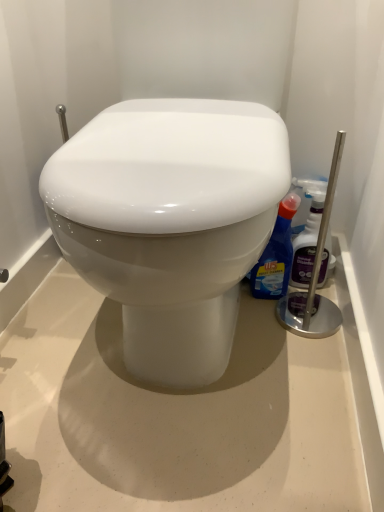
Question: Does translucent plastic spray bottle at right, which is the second cleaning product from left to right, have a smaller size compared to blue glossy toilet cleaner at right, marked as the 2th cleaning product in a right-to-left arrangement?

Choices:
 (A) no
 (B) yes

Answer: (B)

Question: Can you confirm if translucent plastic spray bottle at right, which is the second cleaning product from left to right, is taller than blue glossy toilet cleaner at right, which is the first cleaning product in left-to-right order?

Choices:
 (A) yes
 (B) no

Answer: (A)

Question: Is there a large distance between translucent plastic spray bottle at right, which is the second cleaning product from left to right, and blue glossy toilet cleaner at right, which is the first cleaning product in left-to-right order?

Choices:
 (A) yes
 (B) no

Answer: (B)

Question: Is translucent plastic spray bottle at right, arranged as the 1th cleaning product when viewed from the right, thinner than blue glossy toilet cleaner at right, which is the first cleaning product in left-to-right order?

Choices:
 (A) no
 (B) yes

Answer: (B)

Question: Does translucent plastic spray bottle at right, arranged as the 1th cleaning product when viewed from the right, have a greater width compared to blue glossy toilet cleaner at right, marked as the 2th cleaning product in a right-to-left arrangement?

Choices:
 (A) no
 (B) yes

Answer: (A)

Question: Is translucent plastic spray bottle at right, arranged as the 1th cleaning product when viewed from the right, at the right side of blue glossy toilet cleaner at right, which is the first cleaning product in left-to-right order?

Choices:
 (A) yes
 (B) no

Answer: (A)

Question: Is blue glossy toilet cleaner at right, which is the first cleaning product in left-to-right order, wider than translucent plastic spray bottle at right, which is the second cleaning product from left to right?

Choices:
 (A) no
 (B) yes

Answer: (B)

Question: Can you confirm if blue glossy toilet cleaner at right, marked as the 2th cleaning product in a right-to-left arrangement, is positioned to the left of translucent plastic spray bottle at right, arranged as the 1th cleaning product when viewed from the right?

Choices:
 (A) no
 (B) yes

Answer: (B)

Question: Considering the relative sizes of blue glossy toilet cleaner at right, marked as the 2th cleaning product in a right-to-left arrangement, and translucent plastic spray bottle at right, arranged as the 1th cleaning product when viewed from the right, in the image provided, is blue glossy toilet cleaner at right, marked as the 2th cleaning product in a right-to-left arrangement, thinner than translucent plastic spray bottle at right, arranged as the 1th cleaning product when viewed from the right,?

Choices:
 (A) no
 (B) yes

Answer: (A)

Question: From a real-world perspective, is blue glossy toilet cleaner at right, which is the first cleaning product in left-to-right order, over translucent plastic spray bottle at right, which is the second cleaning product from left to right?

Choices:
 (A) yes
 (B) no

Answer: (B)

Question: Considering the relative sizes of blue glossy toilet cleaner at right, marked as the 2th cleaning product in a right-to-left arrangement, and translucent plastic spray bottle at right, arranged as the 1th cleaning product when viewed from the right, in the image provided, is blue glossy toilet cleaner at right, marked as the 2th cleaning product in a right-to-left arrangement, shorter than translucent plastic spray bottle at right, arranged as the 1th cleaning product when viewed from the right,?

Choices:
 (A) no
 (B) yes

Answer: (B)

Question: Does blue glossy toilet cleaner at right, marked as the 2th cleaning product in a right-to-left arrangement, have a greater height compared to translucent plastic spray bottle at right, arranged as the 1th cleaning product when viewed from the right?

Choices:
 (A) yes
 (B) no

Answer: (B)

Question: Looking at their shapes, would you say translucent plastic spray bottle at right, which is the second cleaning product from left to right, is wider or thinner than blue glossy toilet cleaner at right, which is the first cleaning product in left-to-right order?

Choices:
 (A) thin
 (B) wide

Answer: (A)